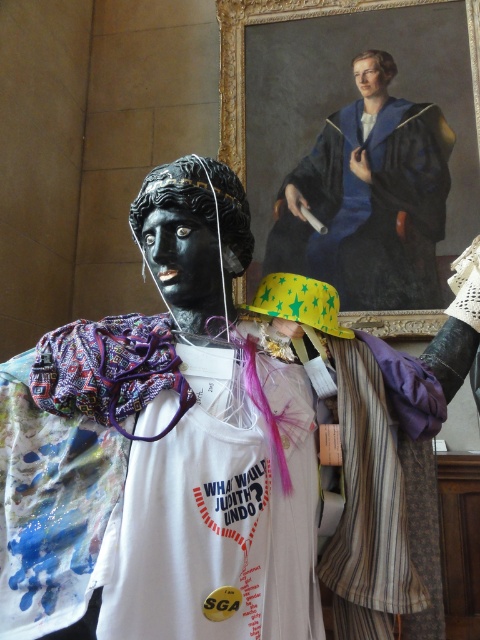
Question: Which point is closer to the camera taking this photo?

Choices:
 (A) (372, 276)
 (B) (35, 416)

Answer: (B)

Question: Does painted fabric tank top at center have a greater width compared to blue velvet robe at upper center?

Choices:
 (A) yes
 (B) no

Answer: (B)

Question: In this image, where is painted fabric tank top at center located relative to blue velvet robe at upper center?

Choices:
 (A) left
 (B) right

Answer: (A)

Question: Which object is farther from the camera taking this photo?

Choices:
 (A) painted fabric tank top at center
 (B) blue velvet robe at upper center

Answer: (B)

Question: Can you confirm if painted fabric tank top at center is positioned below blue velvet robe at upper center?

Choices:
 (A) no
 (B) yes

Answer: (B)